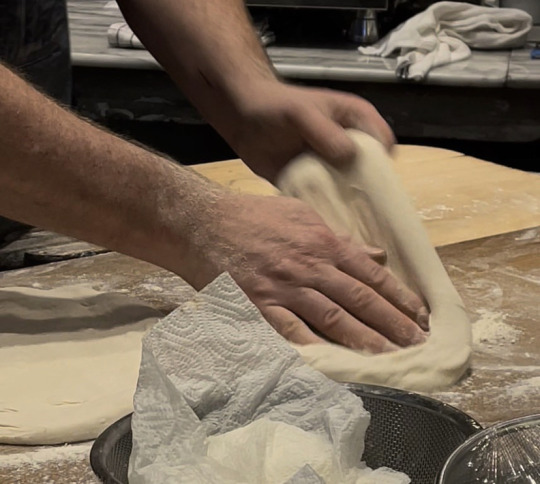
The image size is (540, 484). Identify the location of wood table. (478, 175).